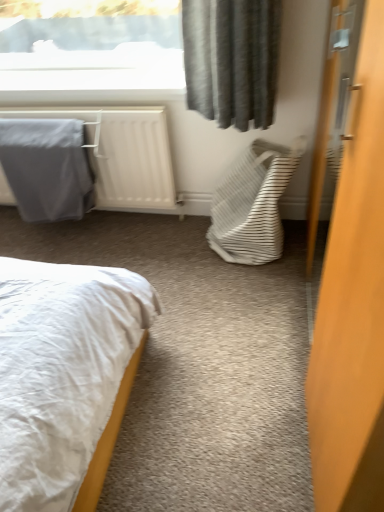
Question: From a real-world perspective, does gray fabric blanket at left sit lower than white striped fabric laundry basket at center-right?

Choices:
 (A) no
 (B) yes

Answer: (A)

Question: Can you confirm if gray fabric blanket at left is thinner than white striped fabric laundry basket at center-right?

Choices:
 (A) yes
 (B) no

Answer: (A)

Question: Is gray fabric blanket at left oriented towards white striped fabric laundry basket at center-right?

Choices:
 (A) yes
 (B) no

Answer: (B)

Question: Is white striped fabric laundry basket at center-right surrounded by gray fabric blanket at left?

Choices:
 (A) no
 (B) yes

Answer: (A)

Question: Is white striped fabric laundry basket at center-right at the back of gray fabric blanket at left?

Choices:
 (A) yes
 (B) no

Answer: (B)

Question: From a real-world perspective, is wooden door at right positioned above or below gray fabric blanket at left?

Choices:
 (A) below
 (B) above

Answer: (B)

Question: In terms of width, does wooden door at right look wider or thinner when compared to gray fabric blanket at left?

Choices:
 (A) thin
 (B) wide

Answer: (B)

Question: Looking at the image, does wooden door at right seem bigger or smaller compared to gray fabric blanket at left?

Choices:
 (A) big
 (B) small

Answer: (A)

Question: Considering the positions of point tap(322, 508) and point tap(71, 162), is point tap(322, 508) closer or farther from the camera than point tap(71, 162)?

Choices:
 (A) farther
 (B) closer

Answer: (B)

Question: Considering the positions of gray fabric at left and white striped fabric laundry basket at center-right in the image, is gray fabric at left bigger or smaller than white striped fabric laundry basket at center-right?

Choices:
 (A) big
 (B) small

Answer: (A)

Question: Considering the positions of gray fabric at left and white striped fabric laundry basket at center-right in the image, is gray fabric at left wider or thinner than white striped fabric laundry basket at center-right?

Choices:
 (A) wide
 (B) thin

Answer: (B)

Question: Considering the positions of gray fabric at left and white striped fabric laundry basket at center-right in the image, is gray fabric at left taller or shorter than white striped fabric laundry basket at center-right?

Choices:
 (A) tall
 (B) short

Answer: (B)

Question: Considering the relative positions of gray fabric at left and white striped fabric laundry basket at center-right in the image provided, is gray fabric at left to the left or to the right of white striped fabric laundry basket at center-right?

Choices:
 (A) left
 (B) right

Answer: (A)

Question: Considering the positions of wooden door at right and gray fabric at left in the image, is wooden door at right wider or thinner than gray fabric at left?

Choices:
 (A) wide
 (B) thin

Answer: (B)

Question: From the image's perspective, is wooden door at right above or below gray fabric at left?

Choices:
 (A) below
 (B) above

Answer: (A)